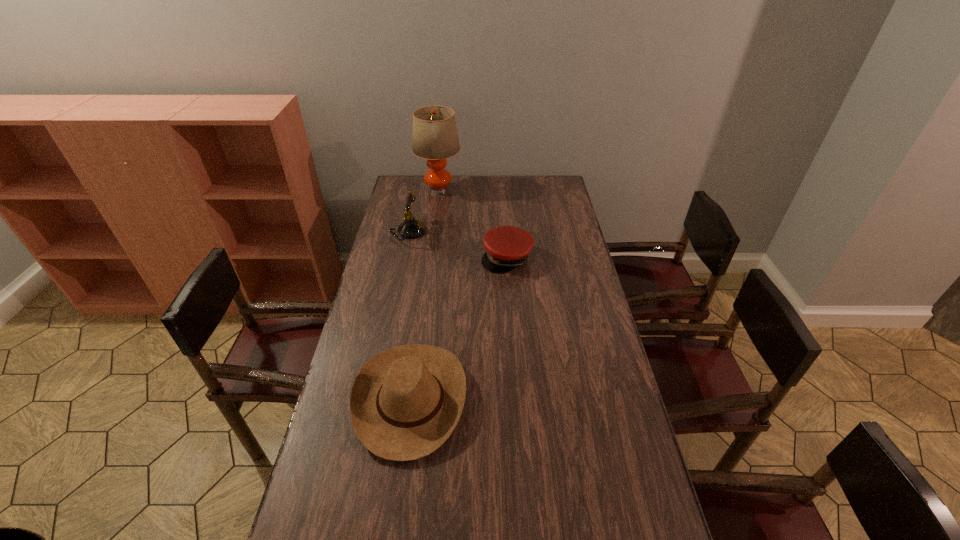
This screenshot has height=540, width=960. Find the location of `object that is at the far edge`. object that is at the far edge is located at coordinates (435, 137).

Locate an element on the screen. lamp that is at the left edge is located at coordinates (435, 137).

Locate an element on the screen. telephone located in the left edge section of the desktop is located at coordinates (411, 228).

You are a GUI agent. You are given a task and a screenshot of the screen. Output one action in this format:
    pyautogui.click(x=<x>, y=<y>)
    Task: Click on the cowboy hat that is at the left edge
    This screenshot has height=540, width=960.
    Given the screenshot: What is the action you would take?
    coord(405,402)

Identify the location of object that is at the far left corner. This screenshot has height=540, width=960. (435, 137).

You are a GUI agent. You are given a task and a screenshot of the screen. Output one action in this format:
    pyautogui.click(x=<x>, y=<y>)
    Task: Click on the free space at the far edge of the desktop
    The width and height of the screenshot is (960, 540).
    Given the screenshot: What is the action you would take?
    pyautogui.click(x=520, y=191)

The width and height of the screenshot is (960, 540). Identify the location of free space at the right edge of the desktop. tap(569, 207).

I want to click on vacant area at the far right corner, so click(x=563, y=184).

The image size is (960, 540). Find the location of `unoccupied area between the rightmost object and the telephone`. unoccupied area between the rightmost object and the telephone is located at coordinates (457, 245).

What are the coordinates of `vacant space in between the nearest object and the lamp` in the screenshot? It's located at (424, 294).